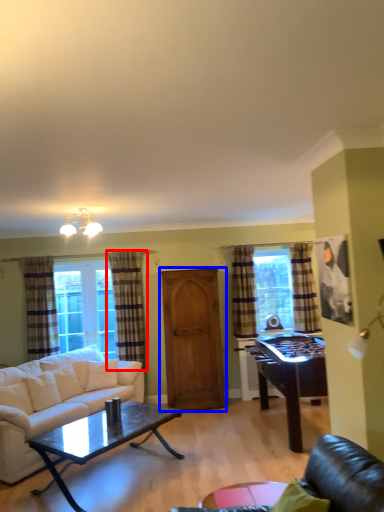
Question: Which object is closer to the camera taking this photo, curtain (highlighted by a red box) or armoire (highlighted by a blue box)?

Choices:
 (A) curtain
 (B) armoire

Answer: (B)